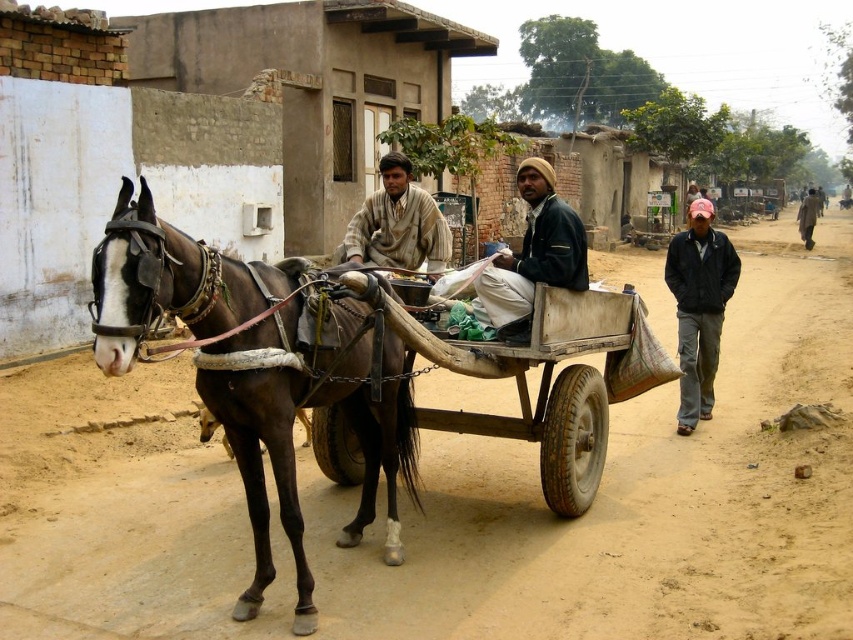
You are a delivery person who needs to attach a 3.5 meter long rope to the brown glossy horse at left and the pink fabric cap at right. Is the rope long enough to connect them?

The brown glossy horse at left is 3.13 meters from the pink fabric cap at right. The rope is 3.5 meters long, which is longer than the distance between them. Therefore, the rope is long enough to connect the brown glossy horse at left and the pink fabric cap at right.

Please describe the position of the brown glossy horse at left in terms of coordinates in the image. The image has a coordinate system where the bottom left corner is the origin point. The x and y values range from 0 to 1. Please provide the coordinates as a pair of numbers separated by a comma. The answer should be concise and only include the coordinates without any additional explanation.

The coordinates of the brown glossy horse at left are (260, 371).

You are a passenger on the cart and want to step onto the brown dirt track at lower left. Which side of the brown glossy horse at left should you move to?

The brown dirt track at lower left is on the right side of the brown glossy horse at left, so you should move to the right side of the brown glossy horse at left to reach it.